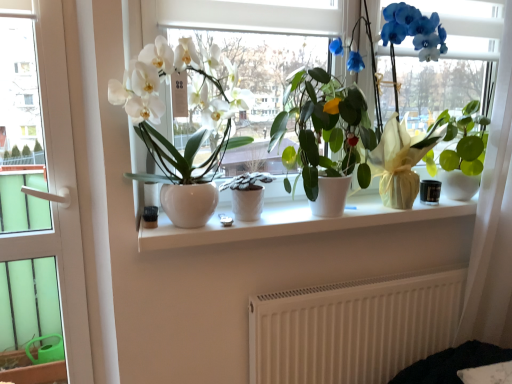
Question: Is white textured pot at center, which appears as the 2th houseplant when viewed from the right, turned away from white ceramic window sill at center?

Choices:
 (A) no
 (B) yes

Answer: (A)

Question: Considering the relative positions of white textured pot at center, the second houseplant in the left-to-right sequence, and white ceramic window sill at center in the image provided, is white textured pot at center, the second houseplant in the left-to-right sequence, behind white ceramic window sill at center?

Choices:
 (A) yes
 (B) no

Answer: (A)

Question: Considering the relative positions of white textured pot at center, the second houseplant in the left-to-right sequence, and white ceramic window sill at center in the image provided, is white textured pot at center, the second houseplant in the left-to-right sequence, to the right of white ceramic window sill at center from the viewer's perspective?

Choices:
 (A) yes
 (B) no

Answer: (B)

Question: From the image's perspective, is white textured pot at center, which appears as the 2th houseplant when viewed from the right, under white ceramic window sill at center?

Choices:
 (A) yes
 (B) no

Answer: (B)

Question: Considering the relative sizes of white textured pot at center, the second houseplant in the left-to-right sequence, and white ceramic window sill at center in the image provided, is white textured pot at center, the second houseplant in the left-to-right sequence, shorter than white ceramic window sill at center?

Choices:
 (A) yes
 (B) no

Answer: (B)

Question: From their relative heights in the image, would you say white textured pot at center, which appears as the 2th houseplant when viewed from the right, is taller or shorter than white glossy vase at center?

Choices:
 (A) short
 (B) tall

Answer: (A)

Question: Relative to white glossy vase at center, is white textured pot at center, which appears as the 2th houseplant when viewed from the right, in front or behind?

Choices:
 (A) behind
 (B) front

Answer: (A)

Question: Considering the relative positions of white textured pot at center, which appears as the 2th houseplant when viewed from the right, and white glossy vase at center in the image provided, is white textured pot at center, which appears as the 2th houseplant when viewed from the right, to the left or to the right of white glossy vase at center?

Choices:
 (A) left
 (B) right

Answer: (A)

Question: Considering the positions of point (256, 203) and point (337, 66), is point (256, 203) closer or farther from the camera than point (337, 66)?

Choices:
 (A) closer
 (B) farther

Answer: (A)

Question: Considering the positions of green glossy leafy plant at right, acting as the 3th houseplant starting from the left, and white sheer curtain at right in the image, is green glossy leafy plant at right, acting as the 3th houseplant starting from the left, taller or shorter than white sheer curtain at right?

Choices:
 (A) short
 (B) tall

Answer: (A)

Question: Looking at their shapes, would you say green glossy leafy plant at right, which is the 1th houseplant from right to left, is wider or thinner than white sheer curtain at right?

Choices:
 (A) thin
 (B) wide

Answer: (B)

Question: Is point (449, 178) closer or farther from the camera than point (509, 329)?

Choices:
 (A) farther
 (B) closer

Answer: (B)

Question: Considering their positions, is green glossy leafy plant at right, which is the 1th houseplant from right to left, located in front of or behind white sheer curtain at right?

Choices:
 (A) front
 (B) behind

Answer: (B)

Question: From a real-world perspective, is white sheer curtain at right physically located above or below green glossy leafy plant at right, which is the 1th houseplant from right to left?

Choices:
 (A) below
 (B) above

Answer: (A)

Question: Considering the relative positions of white sheer curtain at right and green glossy leafy plant at right, acting as the 3th houseplant starting from the left, in the image provided, is white sheer curtain at right to the left or to the right of green glossy leafy plant at right, acting as the 3th houseplant starting from the left,?

Choices:
 (A) right
 (B) left

Answer: (A)